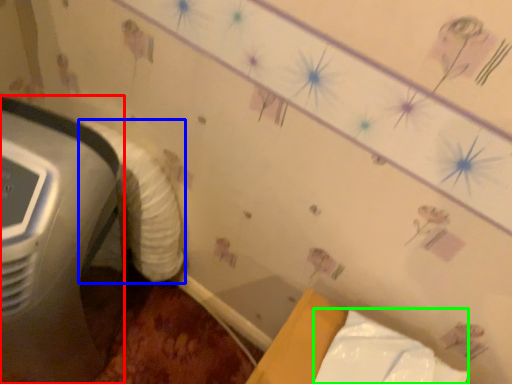
Question: Which object is the farthest from home appliance (highlighted by a red box)? Choose among these: sheet (highlighted by a blue box) or wrapping paper (highlighted by a green box).

Choices:
 (A) sheet
 (B) wrapping paper

Answer: (B)